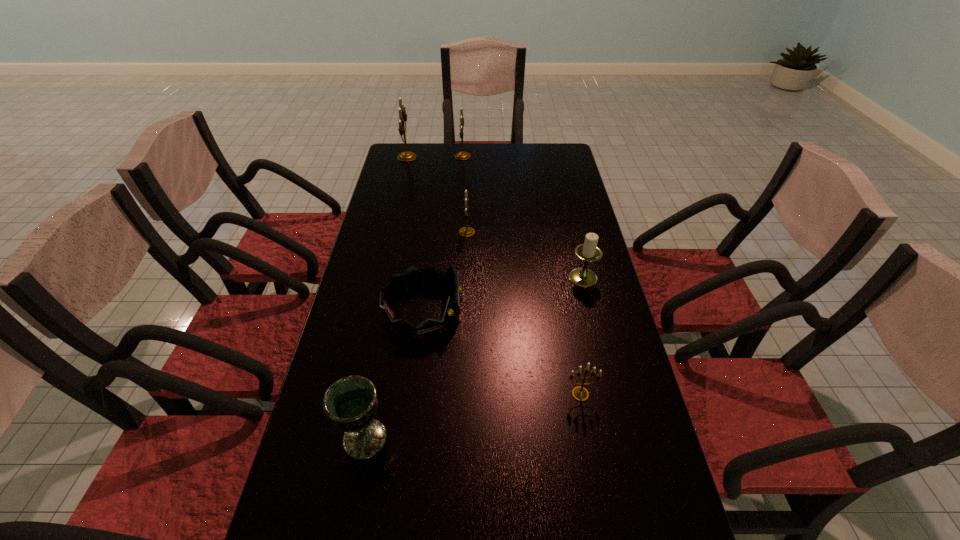
Where is `free location that satisfies the following two spatial constraints: 1. on the back side of the rightmost gold candelabrum; 2. on the right side of the chalice`? Image resolution: width=960 pixels, height=540 pixels. free location that satisfies the following two spatial constraints: 1. on the back side of the rightmost gold candelabrum; 2. on the right side of the chalice is located at coordinates (373, 394).